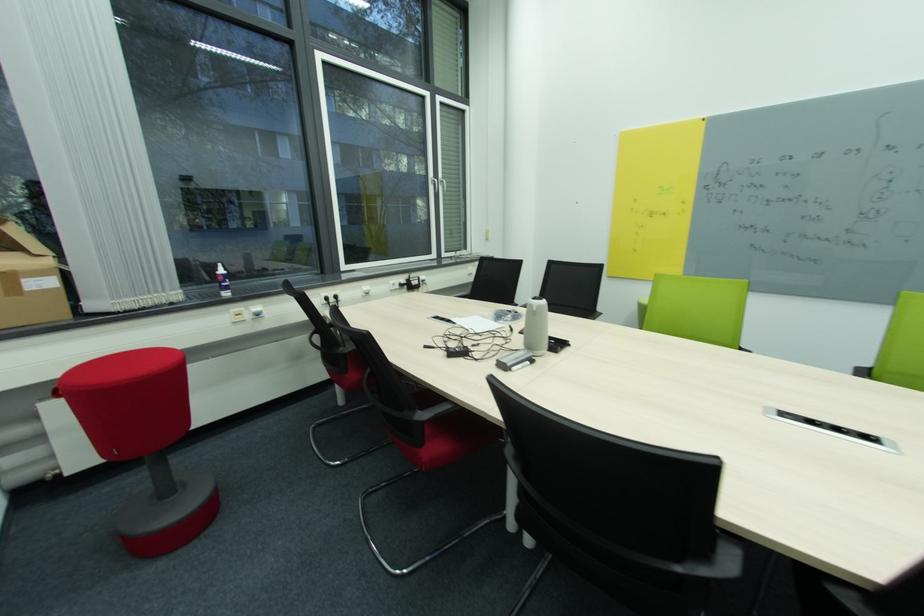
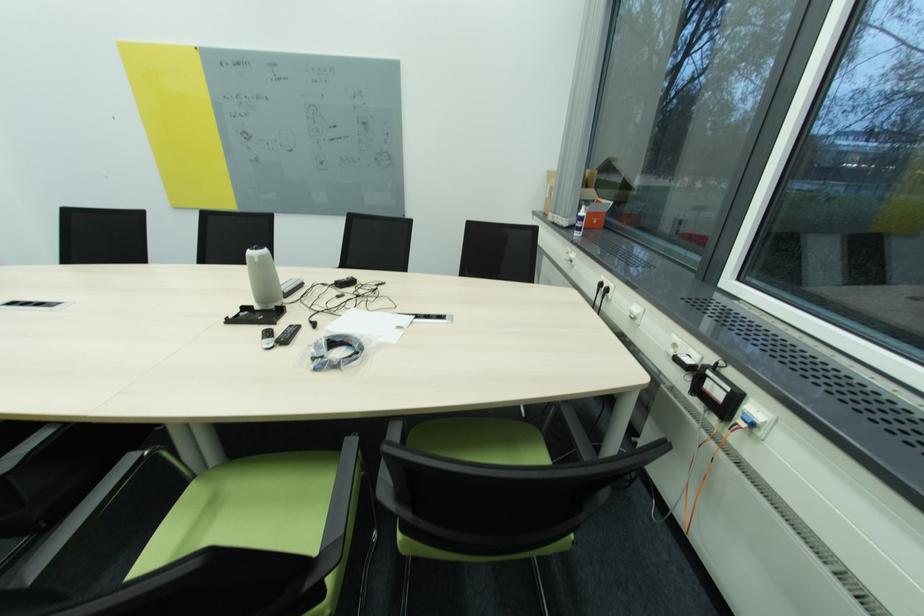
Where in the second image is the point corresponding to pixel 341 298 from the first image?

(612, 291)